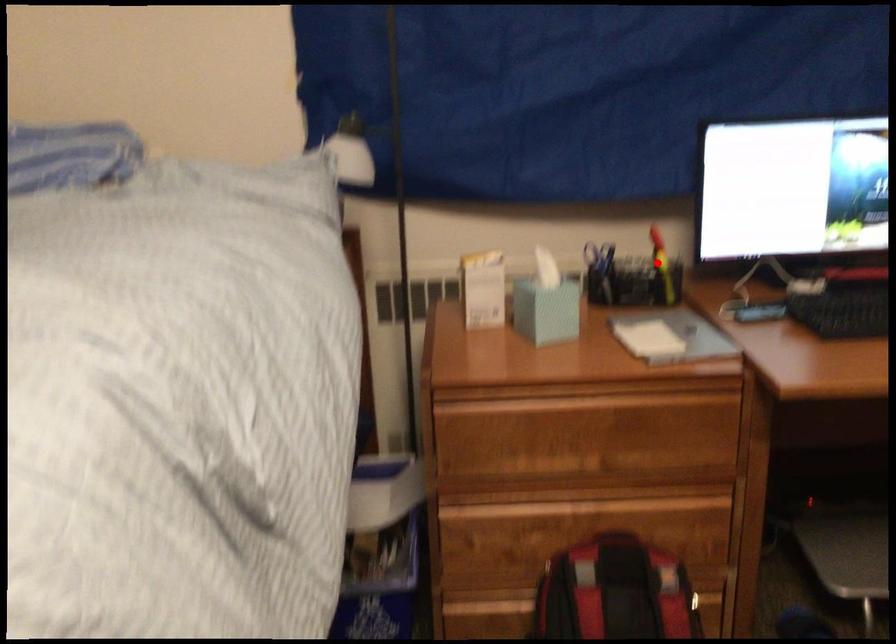
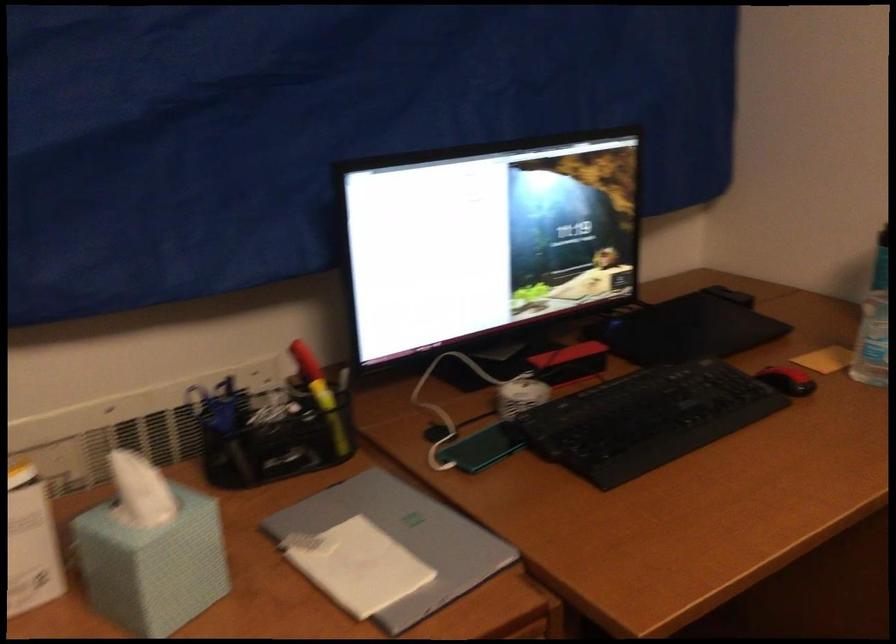
Question: I am providing you with two images of the same scene from different viewpoints. A red point is shown in image1. For the corresponding object point in image2, is it positioned nearer or farther from the camera?

Choices:
 (A) Nearer
 (B) Farther

Answer: (A)